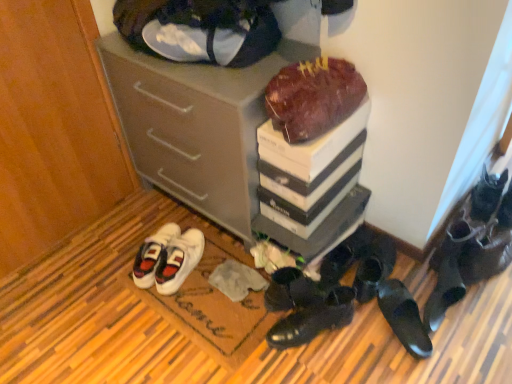
Where is `black leather shoes at lower right, placed as the 3th footwear when sorted from left to right`? The width and height of the screenshot is (512, 384). black leather shoes at lower right, placed as the 3th footwear when sorted from left to right is located at coordinates (290, 290).

Measure the distance between point (360, 284) and camera.

The distance of point (360, 284) from camera is 1.52 meters.

Image resolution: width=512 pixels, height=384 pixels. Describe the element at coordinates (404, 317) in the screenshot. I see `black leather shoes at lower right, positioned as the sixth footwear in left-to-right order` at that location.

The height and width of the screenshot is (384, 512). Describe the element at coordinates (178, 260) in the screenshot. I see `white suede sneakers at lower left, marked as the first footwear in a left-to-right arrangement` at that location.

This screenshot has width=512, height=384. I want to click on leather handbag at upper center, so (x=213, y=33).

Would you say black leather shoe at lower right, acting as the 9th footwear starting from the left, is outside black leather shoes at lower center, acting as the second footwear starting from the left?

Indeed, black leather shoe at lower right, acting as the 9th footwear starting from the left, is completely outside black leather shoes at lower center, acting as the second footwear starting from the left.

Is black leather shoe at lower right, the first footwear from the right, wider or thinner than black leather shoes at lower center, placed as the 8th footwear when sorted from right to left?

Considering their sizes, black leather shoe at lower right, the first footwear from the right, looks broader than black leather shoes at lower center, placed as the 8th footwear when sorted from right to left.

Are black leather shoe at lower right, acting as the 9th footwear starting from the left, and black leather shoes at lower center, placed as the 8th footwear when sorted from right to left, far apart?

They are positioned close to each other.

Considering the relative sizes of black leather shoe at lower right, the first footwear from the right, and black leather shoes at lower center, acting as the second footwear starting from the left, in the image provided, is black leather shoe at lower right, the first footwear from the right, smaller than black leather shoes at lower center, acting as the second footwear starting from the left,?

No, black leather shoe at lower right, the first footwear from the right, is not smaller than black leather shoes at lower center, acting as the second footwear starting from the left.

Considering the relative sizes of black leather shoes at lower right, placed as the 3th footwear when sorted from left to right, and chocolate matte cake at upper center in the image provided, is black leather shoes at lower right, placed as the 3th footwear when sorted from left to right, shorter than chocolate matte cake at upper center?

Yes, black leather shoes at lower right, placed as the 3th footwear when sorted from left to right, is shorter than chocolate matte cake at upper center.

Do you think black leather shoes at lower right, which is the seventh footwear in right-to-left order, is within chocolate matte cake at upper center, or outside of it?

black leather shoes at lower right, which is the seventh footwear in right-to-left order, is not inside chocolate matte cake at upper center, it's outside.

Considering the points (286, 301) and (291, 138), which point is behind, point (286, 301) or point (291, 138)?

Positioned behind is point (286, 301).

Is matte gray cabinet at center outside of black leather shoes at lower right, which is the seventh footwear in right-to-left order?

Yes, matte gray cabinet at center is not within black leather shoes at lower right, which is the seventh footwear in right-to-left order.

Does matte gray cabinet at center have a lesser height compared to black leather shoes at lower right, which is the seventh footwear in right-to-left order?

No.

From the picture: Between matte gray cabinet at center and black leather shoes at lower right, which is the seventh footwear in right-to-left order, which one has larger width?

matte gray cabinet at center is wider.

Can you confirm if matte gray cabinet at center is bigger than black leather shoes at lower right, which is the seventh footwear in right-to-left order?

Correct, matte gray cabinet at center is larger in size than black leather shoes at lower right, which is the seventh footwear in right-to-left order.

From a real-world perspective, is black leather shoes at lower center, acting as the second footwear starting from the left, above or below black leather shoe at lower right, acting as the 9th footwear starting from the left?

black leather shoes at lower center, acting as the second footwear starting from the left, is situated lower than black leather shoe at lower right, acting as the 9th footwear starting from the left, in the real world.

Is black leather shoes at lower center, acting as the second footwear starting from the left, oriented away from black leather shoe at lower right, the first footwear from the right?

That's right, black leather shoes at lower center, acting as the second footwear starting from the left, is facing away from black leather shoe at lower right, the first footwear from the right.

Considering the relative sizes of black leather shoes at lower center, acting as the second footwear starting from the left, and black leather shoe at lower right, the first footwear from the right, in the image provided, is black leather shoes at lower center, acting as the second footwear starting from the left, bigger than black leather shoe at lower right, the first footwear from the right,?

No, black leather shoes at lower center, acting as the second footwear starting from the left, is not bigger than black leather shoe at lower right, the first footwear from the right.

In terms of height, does black leather shoes at lower right, the 3th footwear viewed from the right, look taller or shorter compared to chocolate matte cake at upper center?

In the image, black leather shoes at lower right, the 3th footwear viewed from the right, appears to be taller than chocolate matte cake at upper center.

Is black leather shoes at lower right, arranged as the seventh footwear when viewed from the left, with chocolate matte cake at upper center?

No, black leather shoes at lower right, arranged as the seventh footwear when viewed from the left, is not beside chocolate matte cake at upper center.

Is black leather shoes at lower right, the 3th footwear viewed from the right, positioned with its back to chocolate matte cake at upper center?

No, black leather shoes at lower right, the 3th footwear viewed from the right, is not facing the opposite direction of chocolate matte cake at upper center.

How different are the orientations of black leather shoes at lower right, the 3th footwear viewed from the right, and chocolate matte cake at upper center in degrees?

They differ by 6.13 degrees in their facing directions.

Is chocolate matte cake at upper center next to leather handbag at upper center?

chocolate matte cake at upper center and leather handbag at upper center are clearly separated.

Can you confirm if chocolate matte cake at upper center is positioned to the left of leather handbag at upper center?

Incorrect, chocolate matte cake at upper center is not on the left side of leather handbag at upper center.

From the image's perspective, is chocolate matte cake at upper center beneath leather handbag at upper center?

Yes.

Is chocolate matte cake at upper center thinner than leather handbag at upper center?

Yes.

Is black leather shoes at lower right, the 2th footwear when ordered from right to left, located within black leather shoes at lower right, the fourth footwear viewed from the left?

Definitely not — black leather shoes at lower right, the 2th footwear when ordered from right to left, is not inside black leather shoes at lower right, the fourth footwear viewed from the left.

From a real-world perspective, is black leather shoes at lower right, the fourth footwear viewed from the left, over black leather shoes at lower right, placed as the 8th footwear when sorted from left to right?

Incorrect, from a real-world perspective, black leather shoes at lower right, the fourth footwear viewed from the left, is lower than black leather shoes at lower right, placed as the 8th footwear when sorted from left to right.

From the image's perspective, count 1st footwears upward from the black leather shoes at lower right, the 6th footwear viewed from the right, and point to it. Please provide its 2D coordinates.

[(473, 245)]

Looking at their sizes, would you say black leather shoes at lower right, the fourth footwear viewed from the left, is wider or thinner than black leather shoes at lower right, placed as the 8th footwear when sorted from left to right?

In the image, black leather shoes at lower right, the fourth footwear viewed from the left, appears to be wider than black leather shoes at lower right, placed as the 8th footwear when sorted from left to right.

Identify the location of the 5th footwear in front of the black leather shoe at lower right, acting as the 9th footwear starting from the left. (313, 319).

I want to click on chocolate cake lying on the left of black leather shoes at lower right, placed as the 3th footwear when sorted from left to right, so click(313, 97).

From the image, which object appears to be nearer to black leather shoes at lower right, the fourth footwear viewed from the left, chocolate matte cake at upper center or black leather shoes at lower right, which is the seventh footwear in right-to-left order?

black leather shoes at lower right, which is the seventh footwear in right-to-left order, is closer to black leather shoes at lower right, the fourth footwear viewed from the left.

Looking at this image, which object lies further to the anchor point black leather shoe at lower right, the first footwear from the right, black leather shoes at lower right, the fourth footwear from the right, or white suede sneakers at lower left, marked as the first footwear in a left-to-right arrangement?

white suede sneakers at lower left, marked as the first footwear in a left-to-right arrangement, lies further to black leather shoe at lower right, the first footwear from the right, than the other object.

Looking at the image, which one is located further to black leather shoes at lower center, acting as the second footwear starting from the left, black leather shoes at lower right, which is the seventh footwear in right-to-left order, or black leather shoes at lower right, arranged as the seventh footwear when viewed from the left?

black leather shoes at lower right, arranged as the seventh footwear when viewed from the left.

Consider the image. Based on their spatial positions, is chocolate matte cake at upper center or matte gray cabinet at center further from shiny black shoes at lower right, which is the 5th footwear from right to left?

Among the two, matte gray cabinet at center is located further to shiny black shoes at lower right, which is the 5th footwear from right to left.

When comparing their distances from black leather shoes at lower right, the 3th footwear viewed from the right, does white suede sneakers at lower left, placed as the 9th footwear when sorted from right to left, or white fabric doormat at lower center seem closer?

Among the two, white fabric doormat at lower center is located nearer to black leather shoes at lower right, the 3th footwear viewed from the right.

Consider the image. When comparing their distances from black leather shoes at lower right, arranged as the seventh footwear when viewed from the left, does black leather shoes at lower right, placed as the 3th footwear when sorted from left to right, or black leather shoe at lower right, the first footwear from the right, seem further?

Based on the image, black leather shoes at lower right, placed as the 3th footwear when sorted from left to right, appears to be further to black leather shoes at lower right, arranged as the seventh footwear when viewed from the left.

Based on the photo, when comparing their distances from black leather shoes at lower right, arranged as the seventh footwear when viewed from the left, does black leather shoes at lower center, acting as the second footwear starting from the left, or black leather shoe at lower right, acting as the 9th footwear starting from the left, seem further?

Based on the image, black leather shoes at lower center, acting as the second footwear starting from the left, appears to be further to black leather shoes at lower right, arranged as the seventh footwear when viewed from the left.

Estimate the real-world distances between objects in this image. Which object is closer to white fabric doormat at lower center, black leather shoe at lower right, acting as the 9th footwear starting from the left, or white suede sneakers at lower left, marked as the first footwear in a left-to-right arrangement?

Among the two, white suede sneakers at lower left, marked as the first footwear in a left-to-right arrangement, is located nearer to white fabric doormat at lower center.

The image size is (512, 384). I want to click on footwear located between black leather shoes at lower right, positioned as the sixth footwear in left-to-right order, and black leather shoes at lower right, the 2th footwear when ordered from right to left, in the left-right direction, so click(x=449, y=271).

At what (x,y) coordinates should I click in order to perform the action: click on handbag between matte gray cabinet at center and black leather shoes at lower right, placed as the 8th footwear when sorted from left to right, in the horizontal direction. Please return your answer as a coordinate pair (x, y). Looking at the image, I should click on point(213,33).

This screenshot has width=512, height=384. Find the location of `footwear between white fabric doormat at lower center and black leather shoes at lower right, which is the seventh footwear in right-to-left order`. footwear between white fabric doormat at lower center and black leather shoes at lower right, which is the seventh footwear in right-to-left order is located at coordinates (313, 319).

You are a GUI agent. You are given a task and a screenshot of the screen. Output one action in this format:
    pyautogui.click(x=<x>, y=<y>)
    Task: Click on the cabinetry situated between white fabric doormat at lower center and shiny black shoes at lower right, which is the 5th footwear from right to left, from left to right
    
    Given the screenshot: What is the action you would take?
    pyautogui.click(x=206, y=124)